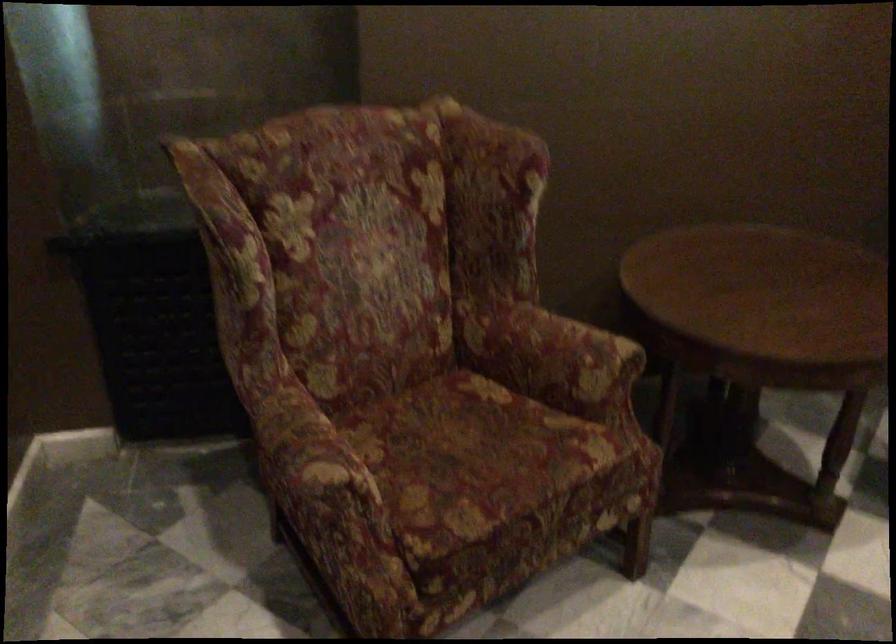
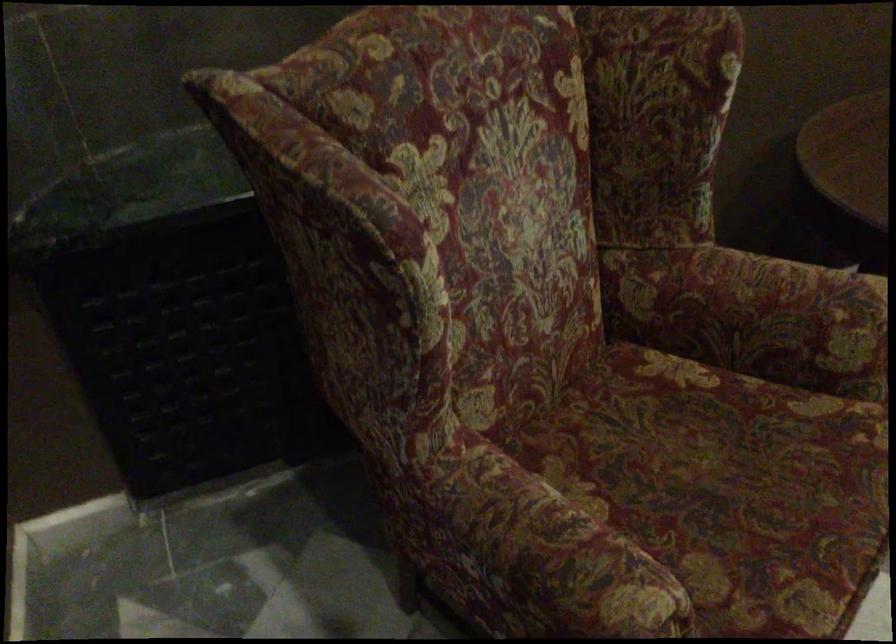
Question: Based on the continuous images, in which direction is the camera rotating? Reply with the corresponding letter.

Choices:
 (A) Left
 (B) Right
 (C) Up
 (D) Down

Answer: (D)